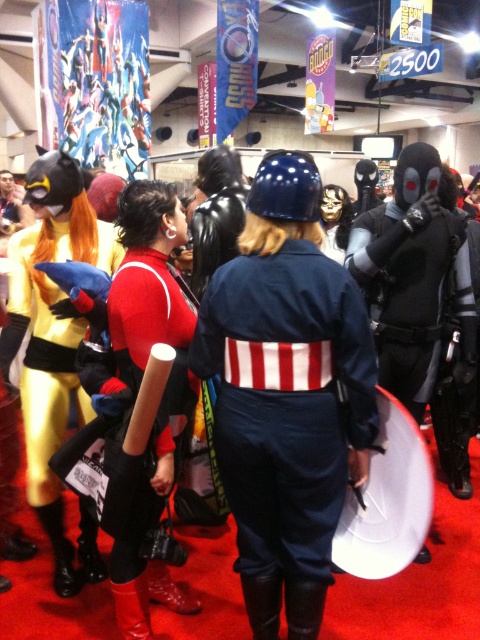
Question: Is yellow fabric costume at left to the left of shiny black helmet at center from the viewer's perspective?

Choices:
 (A) no
 (B) yes

Answer: (B)

Question: Which of the following is the closest to the observer?

Choices:
 (A) rubberized red boots at center
 (B) yellow fabric costume at left
 (C) shiny metallic armor at upper left

Answer: (A)

Question: Which object is closer to the camera taking this photo?

Choices:
 (A) shiny black helmet at center
 (B) shiny metallic armor at upper left
 (C) rubberized red boots at center

Answer: (C)

Question: Does rubberized red boots at center appear on the left side of shiny metallic armor at upper left?

Choices:
 (A) yes
 (B) no

Answer: (B)

Question: Which object is closer to the camera taking this photo?

Choices:
 (A) shiny metallic armor at upper left
 (B) shiny black helmet at center
 (C) rubberized red boots at center
 (D) blue fabric uniform at center

Answer: (D)

Question: Does yellow fabric costume at left appear on the left side of shiny black helmet at center?

Choices:
 (A) yes
 (B) no

Answer: (A)